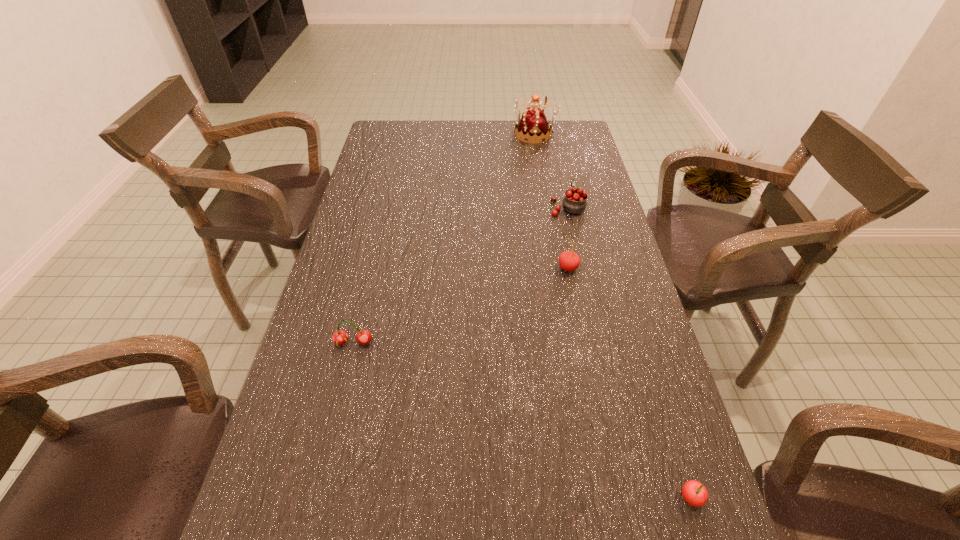
Locate an element on the screen. The width and height of the screenshot is (960, 540). tiara is located at coordinates (533, 124).

Locate an element on the screen. This screenshot has width=960, height=540. the tallest object is located at coordinates (533, 124).

Find the location of `the farthest cherry`. the farthest cherry is located at coordinates (574, 202).

This screenshot has height=540, width=960. I want to click on the second farthest cherry, so click(x=568, y=260).

This screenshot has width=960, height=540. What are the coordinates of `the nearest cherry` in the screenshot? It's located at (694, 493).

The height and width of the screenshot is (540, 960). In order to click on the nearest object in this screenshot , I will do `click(694, 493)`.

Locate an element on the screen. The image size is (960, 540). the leftmost object is located at coordinates (340, 337).

Locate an element on the screen. the second nearest cherry is located at coordinates (340, 337).

Where is `vacant region located 0.360m on the front-facing side of the tallest object`? Image resolution: width=960 pixels, height=540 pixels. vacant region located 0.360m on the front-facing side of the tallest object is located at coordinates (420, 134).

Find the location of a particular element. This screenshot has height=540, width=960. blank space located on the front-facing side of the tallest object is located at coordinates (479, 134).